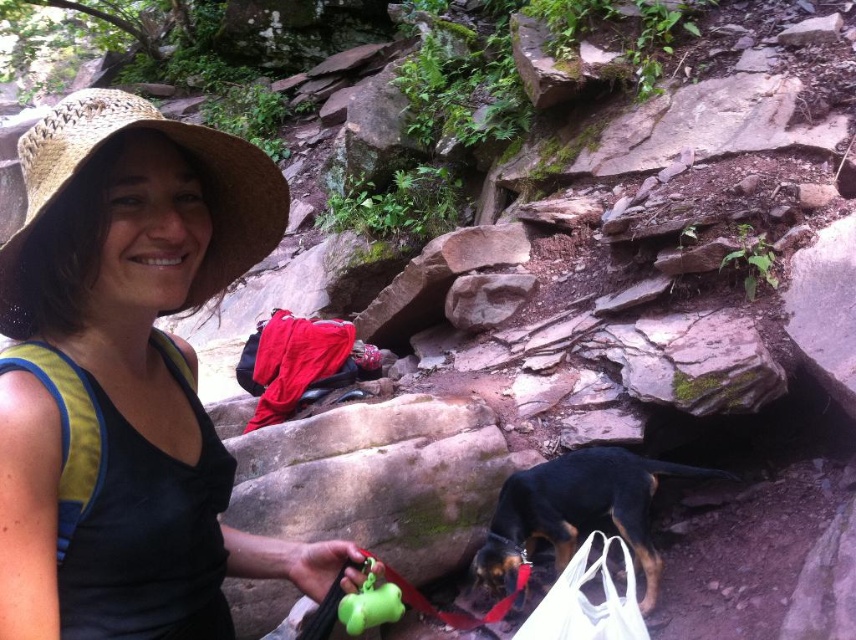
Based on the coordinates provided in the scene description, where exactly is the black and tan fur dog at lower right located?

The black and tan fur dog at lower right is located at point [577,512].

You are a photographer trying to capture a clear shot of the black and tan fur dog at lower right. However, the white plastic bag is blocking your view. Based on the size of the straw hat at upper left, can you estimate whether the dog is small enough to fit behind the bag without being entirely hidden?

The straw hat at upper left is larger than the black and tan fur dog at lower right. Since the dog is smaller than the hat, it might still be possible to position it behind the bag without being fully obscured, provided the bag is sufficiently large. However, the exact visibility would depend on the bag size and positioning.

You are planning to take a photo of the black and tan fur dog at lower right and the white fabric bag at lower right. Since the dog is partially hidden by the bag, which object should you move to get a clear view of the dog?

You should move the white fabric bag at lower right because the black and tan fur dog at lower right is bigger than the white fabric bag at lower right, so moving the smaller bag would allow you to see the dog better.